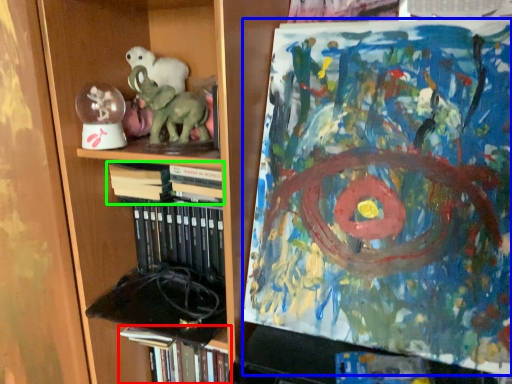
Question: Which object is the farthest from book (highlighted by a red box)? Choose among these: art (highlighted by a blue box) or book (highlighted by a green box).

Choices:
 (A) art
 (B) book

Answer: (A)